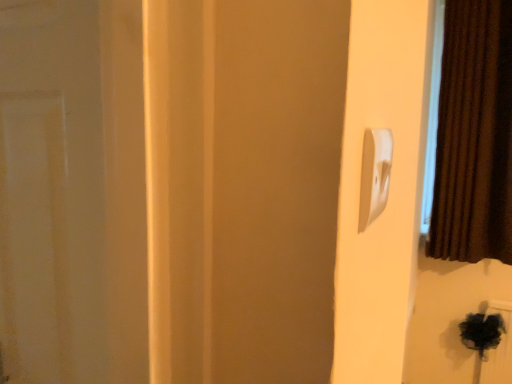
This screenshot has width=512, height=384. Describe the element at coordinates (375, 174) in the screenshot. I see `white plastic light switch at upper right` at that location.

Locate an element on the screen. white plastic light switch at upper right is located at coordinates (375, 174).

Where is `brown velvet curtain at right`? This screenshot has height=384, width=512. brown velvet curtain at right is located at coordinates (474, 135).

This screenshot has width=512, height=384. Describe the element at coordinates (474, 135) in the screenshot. I see `brown velvet curtain at right` at that location.

This screenshot has width=512, height=384. I want to click on white plastic light switch at upper right, so click(375, 174).

Based on the photo, is brown velvet curtain at right to the right of white plastic light switch at upper right from the viewer's perspective?

Indeed, brown velvet curtain at right is positioned on the right side of white plastic light switch at upper right.

Is brown velvet curtain at right in front of white plastic light switch at upper right?

No, brown velvet curtain at right is behind white plastic light switch at upper right.

Which is closer, (443, 99) or (385, 185)?

Point (385, 185)

From the image's perspective, which one is positioned lower, brown velvet curtain at right or white plastic light switch at upper right?

white plastic light switch at upper right appears lower in the image.

From a real-world perspective, who is located higher, brown velvet curtain at right or white plastic light switch at upper right?

brown velvet curtain at right is physically above.

Between brown velvet curtain at right and white plastic light switch at upper right, which one has smaller width?

white plastic light switch at upper right is thinner.

Can you confirm if brown velvet curtain at right is taller than white plastic light switch at upper right?

Correct, brown velvet curtain at right is much taller as white plastic light switch at upper right.

Considering the relative sizes of brown velvet curtain at right and white plastic light switch at upper right in the image provided, is brown velvet curtain at right bigger than white plastic light switch at upper right?

Yes, brown velvet curtain at right is bigger than white plastic light switch at upper right.

Is brown velvet curtain at right inside the boundaries of white plastic light switch at upper right, or outside?

brown velvet curtain at right is located beyond the bounds of white plastic light switch at upper right.

Is brown velvet curtain at right not close to white plastic light switch at upper right?

That's right, there is a large distance between brown velvet curtain at right and white plastic light switch at upper right.

Is white plastic light switch at upper right at the back of brown velvet curtain at right?

No, brown velvet curtain at right is not facing the opposite direction of white plastic light switch at upper right.

Where is `curtain above the white plastic light switch at upper right (from the image's perspective)`? The image size is (512, 384). curtain above the white plastic light switch at upper right (from the image's perspective) is located at coordinates (474, 135).

Based on the photo, between white plastic light switch at upper right and brown velvet curtain at right, which one appears on the right side from the viewer's perspective?

From the viewer's perspective, brown velvet curtain at right appears more on the right side.

Is the depth of white plastic light switch at upper right less than that of brown velvet curtain at right?

Yes, white plastic light switch at upper right is in front of brown velvet curtain at right.

Considering the positions of points (366, 180) and (433, 194), is point (366, 180) closer to camera compared to point (433, 194)?

Yes, it is in front of point (433, 194).

From the image's perspective, is white plastic light switch at upper right above brown velvet curtain at right?

Actually, white plastic light switch at upper right appears below brown velvet curtain at right in the image.

From a real-world perspective, is white plastic light switch at upper right under brown velvet curtain at right?

Correct, in the physical world, white plastic light switch at upper right is lower than brown velvet curtain at right.

Considering the relative sizes of white plastic light switch at upper right and brown velvet curtain at right in the image provided, is white plastic light switch at upper right thinner than brown velvet curtain at right?

Yes, white plastic light switch at upper right is thinner than brown velvet curtain at right.

Does white plastic light switch at upper right have a greater height compared to brown velvet curtain at right?

Incorrect, the height of white plastic light switch at upper right is not larger of that of brown velvet curtain at right.

Does white plastic light switch at upper right have a larger size compared to brown velvet curtain at right?

Incorrect, white plastic light switch at upper right is not larger than brown velvet curtain at right.

Is white plastic light switch at upper right outside of brown velvet curtain at right?

Absolutely, white plastic light switch at upper right is external to brown velvet curtain at right.

Would you consider white plastic light switch at upper right to be distant from brown velvet curtain at right?

Yes, white plastic light switch at upper right and brown velvet curtain at right are quite far apart.

Is white plastic light switch at upper right oriented away from brown velvet curtain at right?

No, white plastic light switch at upper right's orientation is not away from brown velvet curtain at right.

You are a GUI agent. You are given a task and a screenshot of the screen. Output one action in this format:
    pyautogui.click(x=<x>, y=<y>)
    Task: Click on the curtain to the right of white plastic light switch at upper right
    The height and width of the screenshot is (384, 512).
    Given the screenshot: What is the action you would take?
    pyautogui.click(x=474, y=135)

Identify the location of curtain above the white plastic light switch at upper right (from the image's perspective). (474, 135).

You are a GUI agent. You are given a task and a screenshot of the screen. Output one action in this format:
    pyautogui.click(x=<x>, y=<y>)
    Task: Click on the light switch below the brown velvet curtain at right (from a real-world perspective)
    
    Given the screenshot: What is the action you would take?
    pyautogui.click(x=375, y=174)